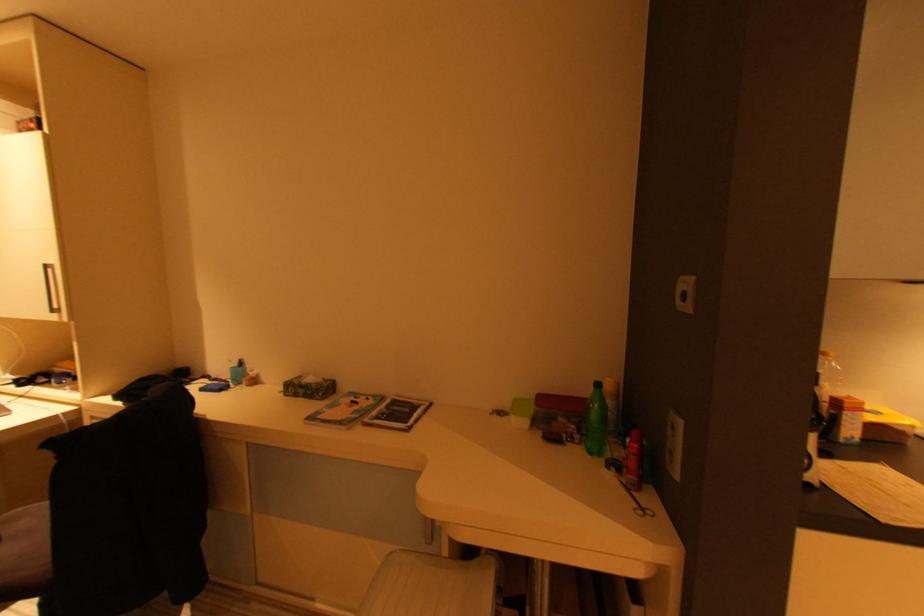
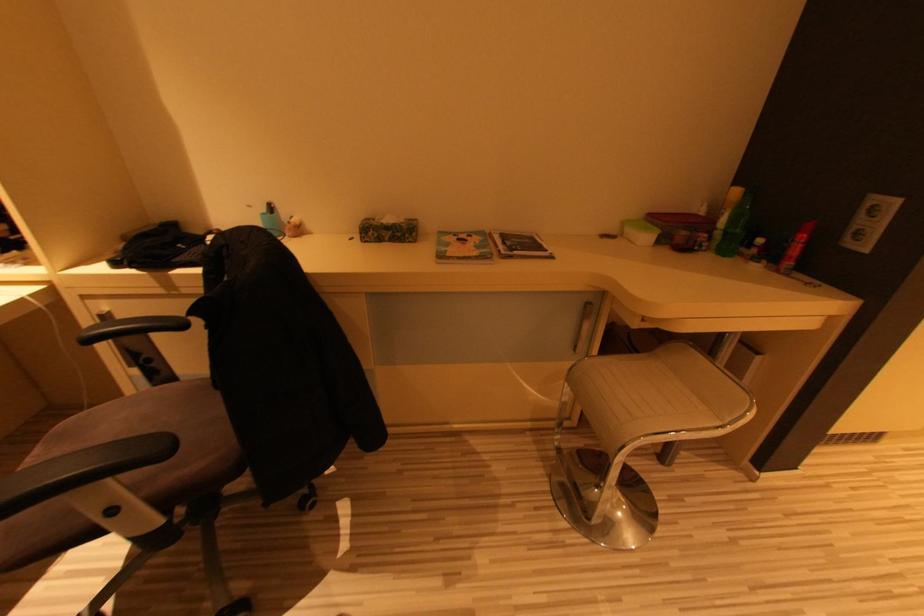
Based on the photo, the first image is from the beginning of the video and the second image is from the end. How did the camera likely rotate when shooting the video?

The camera's rotation is toward right-down.